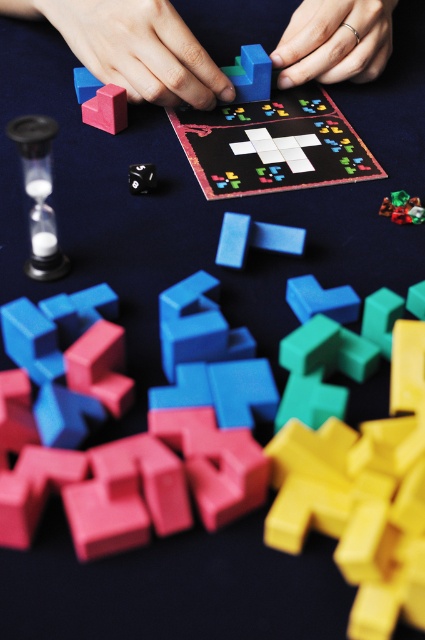
Question: Is matte plastic hand at upper center above rubber blue tetromino at center?

Choices:
 (A) yes
 (B) no

Answer: (A)

Question: Considering the real-world distances, which object is closest to the matte black die at center?

Choices:
 (A) rubberized matte blue tetromino at upper center
 (B) matte plastic hand at upper center
 (C) rubberized matte cube at upper left

Answer: (C)

Question: Which point is farther to the camera?

Choices:
 (A) (289, 24)
 (B) (44, 141)
 (C) (362, 58)

Answer: (A)

Question: Among these points, which one is nearest to the camera?

Choices:
 (A) (380, 67)
 (B) (116, 106)
 (C) (385, 212)
 (D) (164, 88)

Answer: (C)

Question: Can you confirm if rubber blue tetromino at center is positioned to the right of rubberized green cube at center?

Choices:
 (A) no
 (B) yes

Answer: (A)

Question: Does silver metallic ring at upper center have a larger size compared to matte black die at center?

Choices:
 (A) no
 (B) yes

Answer: (B)